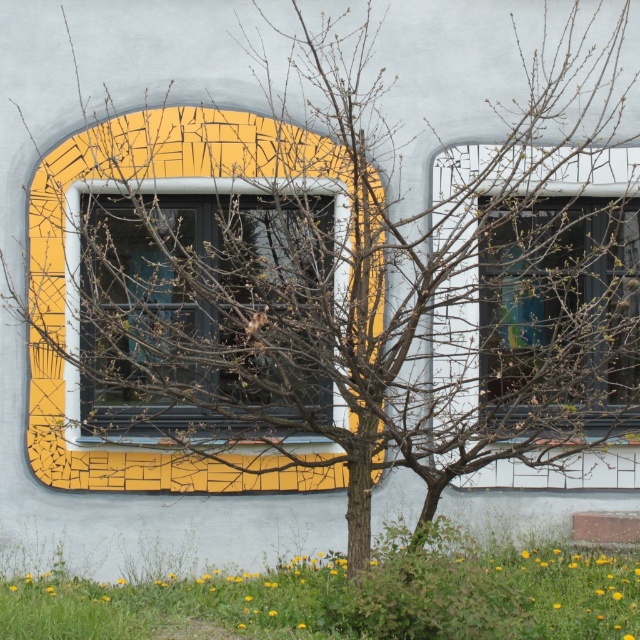
You are a window cleaner standing in front of the building. You need to clean both the yellow mosaic tile at center and the transparent glass window at center. Which object should you clean first if you want to start from the lower one?

The yellow mosaic tile at center is positioned under the transparent glass window at center, so you should clean the yellow mosaic tile at center first since it is lower.